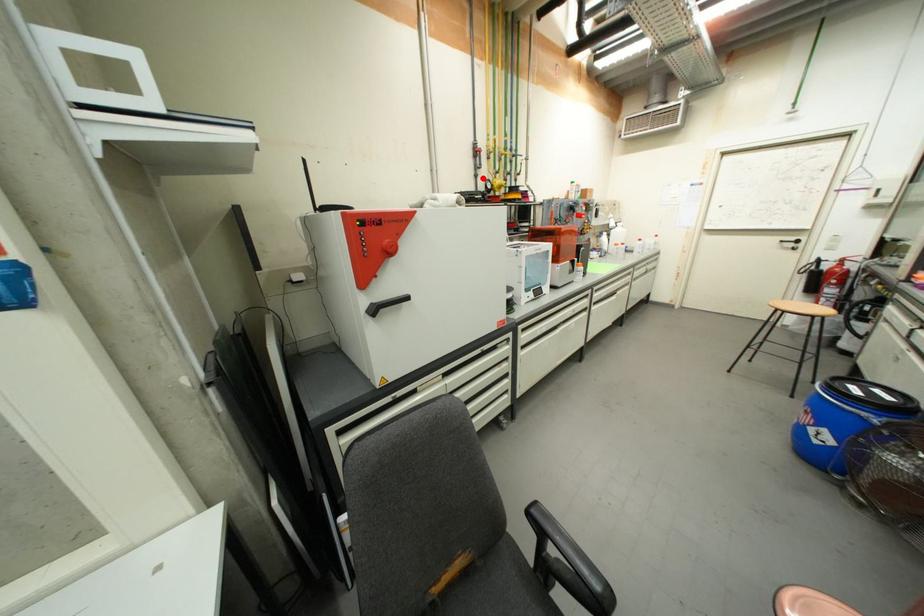
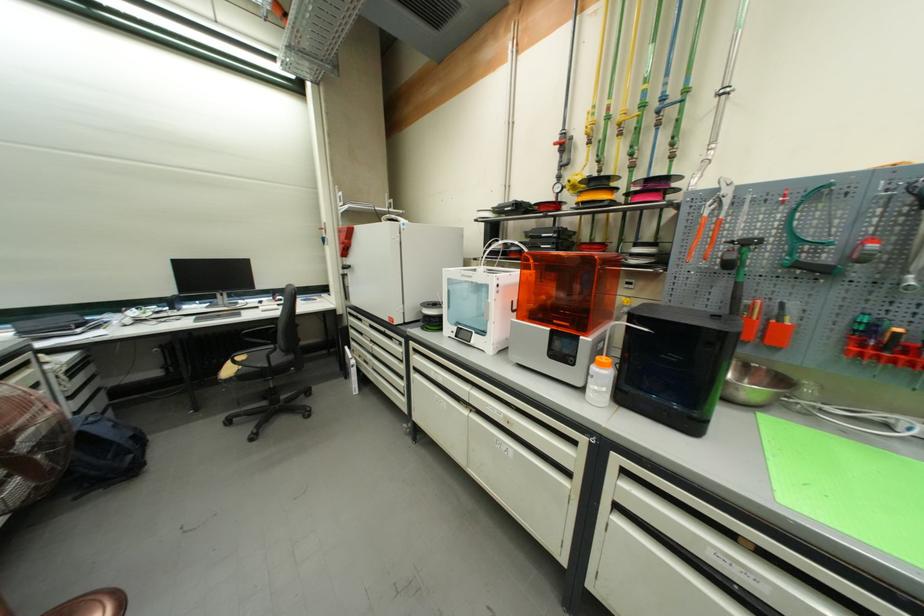
Question: I am providing you with two images of the same scene from different viewpoints. A red point is marked on the first image. Can you still see the location of the red point in image 2?

Choices:
 (A) Yes
 (B) No

Answer: (A)